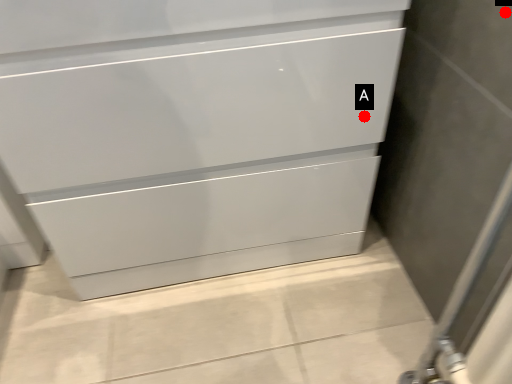
Question: Two points are circled on the image, labeled by A and B beside each circle. Among these points, which one is nearest to the camera?

Choices:
 (A) A is closer
 (B) B is closer

Answer: (B)